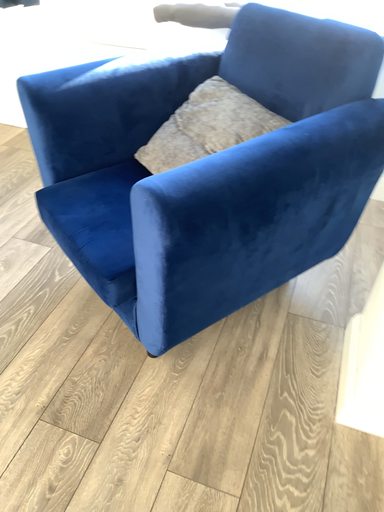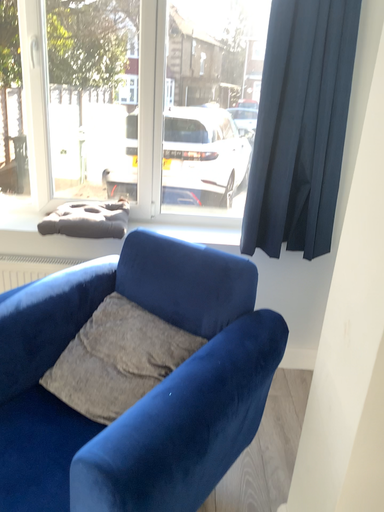
Question: How did the camera likely rotate when shooting the video?

Choices:
 (A) rotated downward
 (B) rotated upward

Answer: (B)